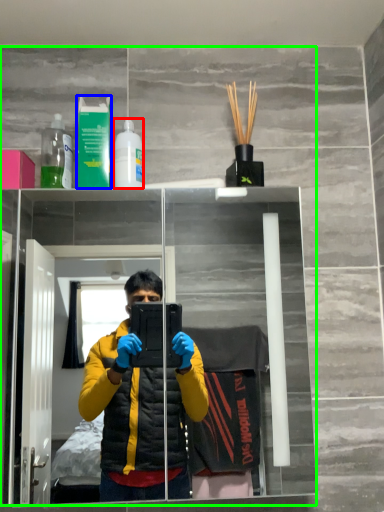
Question: Which object is positioned closest to bottle (highlighted by a red box)? Select from mouthwash (highlighted by a blue box) and mirror (highlighted by a green box).

Choices:
 (A) mouthwash
 (B) mirror

Answer: (A)